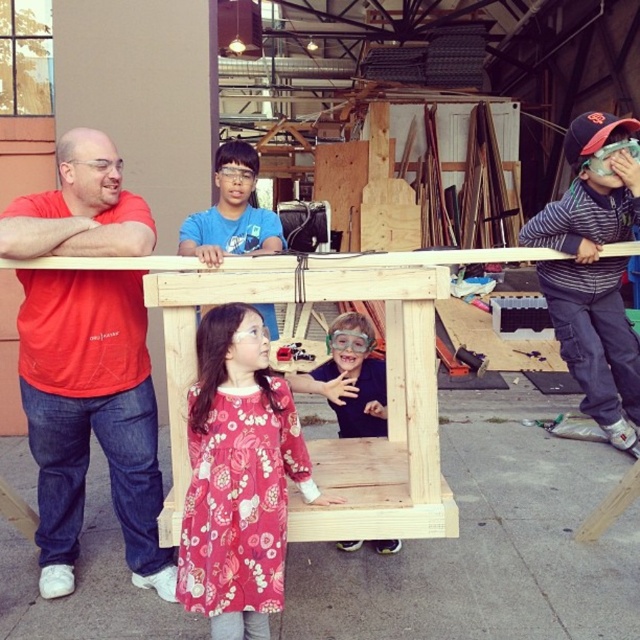
Question: Does matte red shirt at upper left appear over striped knit sweater at right?

Choices:
 (A) yes
 (B) no

Answer: (B)

Question: Which point is closer to the camera?

Choices:
 (A) (340, 410)
 (B) (147, 236)
 (C) (256, 451)

Answer: (C)

Question: Which object is closer to the camera taking this photo?

Choices:
 (A) blue cotton shirt at upper center
 (B) matte black shirt at center
 (C) striped knit sweater at right

Answer: (A)

Question: Which point is farther from the camera taking this photo?

Choices:
 (A) (305, 374)
 (B) (260, 428)
 (C) (244, 193)
 (D) (61, 522)

Answer: (A)

Question: Does matte red shirt at upper left appear on the left side of striped knit sweater at right?

Choices:
 (A) yes
 (B) no

Answer: (A)

Question: Is striped knit sweater at right positioned before matte black shirt at center?

Choices:
 (A) yes
 (B) no

Answer: (B)